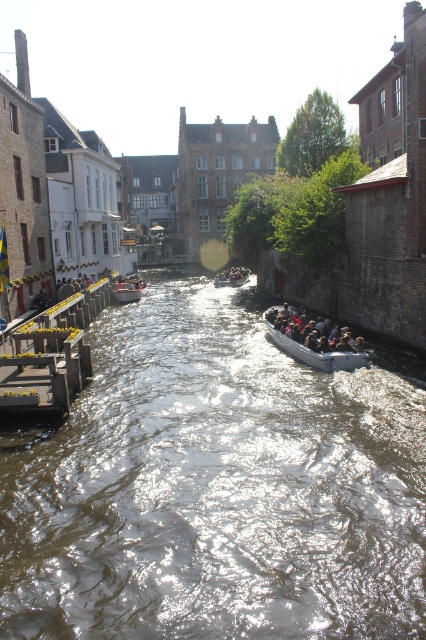
Question: Among these points, which one is farthest from the camera?

Choices:
 (A) (103, 289)
 (B) (284, 348)

Answer: (A)

Question: In this image, where is brown water at center located relative to gray rubber boat at center?

Choices:
 (A) right
 (B) left

Answer: (B)

Question: Which of these objects is positioned farthest from the gray rubber boat at center?

Choices:
 (A) wooden dock at left
 (B) metallic gray boat at center

Answer: (B)

Question: Which of the following is the closest to the observer?

Choices:
 (A) gray rubber boat at center
 (B) metallic gray boat at center
 (C) wooden boat at center
 (D) wooden dock at left

Answer: (D)

Question: Can you confirm if brown water at center is positioned above gray rubber boat at center?

Choices:
 (A) no
 (B) yes

Answer: (A)

Question: Does brown water at center appear under gray rubber boat at center?

Choices:
 (A) no
 (B) yes

Answer: (B)